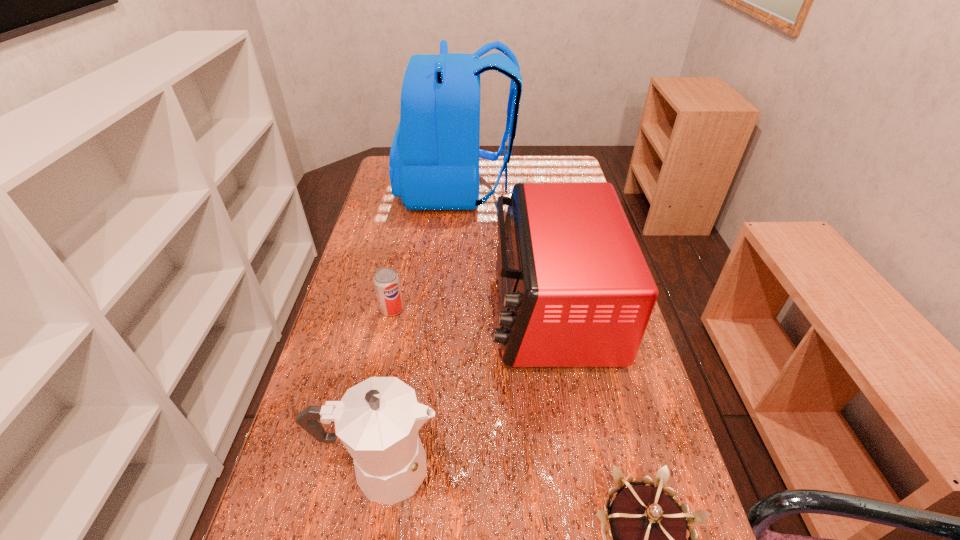
Locate an element on the screen. This screenshot has height=540, width=960. unoccupied area between the toaster oven and the coffeepot is located at coordinates (467, 388).

Locate an element on the screen. This screenshot has height=540, width=960. blank region between the toaster oven and the coffeepot is located at coordinates (467, 388).

You are a GUI agent. You are given a task and a screenshot of the screen. Output one action in this format:
    pyautogui.click(x=<x>, y=<y>)
    Task: Click on the vacant space that is in between the coffeepot and the toaster oven
    Image resolution: width=960 pixels, height=540 pixels.
    Given the screenshot: What is the action you would take?
    pyautogui.click(x=467, y=388)

Where is `free space between the toaster oven and the soda`? free space between the toaster oven and the soda is located at coordinates (471, 308).

I want to click on object that stands as the third closest to the crown, so click(x=386, y=281).

Locate which object is the fourth closest to the backpack. Please provide its 2D coordinates. Your answer should be formatted as a tuple, i.e. [(x, y)], where the tuple contains the x and y coordinates of a point satisfying the conditions above.

[(644, 530)]

This screenshot has height=540, width=960. I want to click on free space that satisfies the following two spatial constraints: 1. on the back of the farthest object; 2. on the front side of the soda, so click(x=448, y=309).